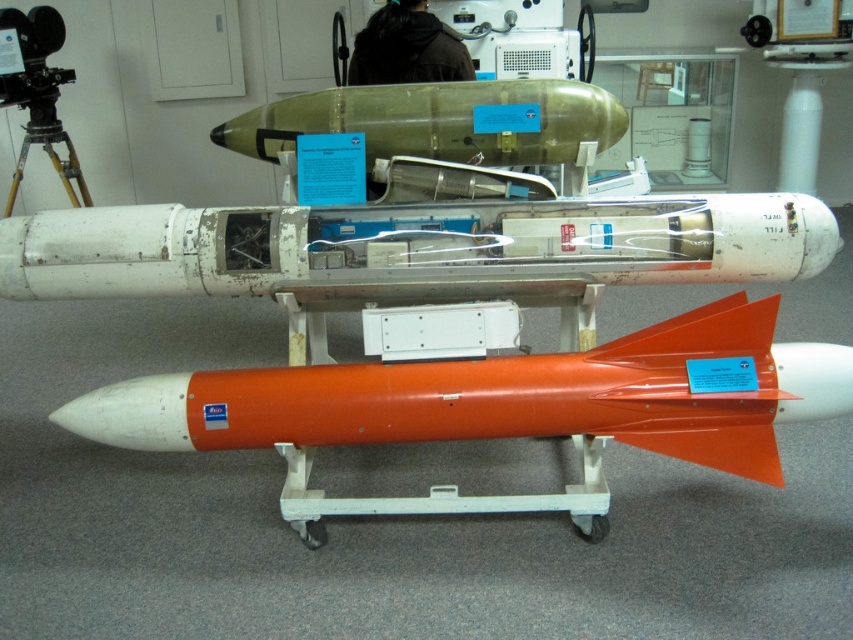
Question: Considering the relative positions of white matte missile at center and orange matte rocket at center in the image provided, where is white matte missile at center located with respect to orange matte rocket at center?

Choices:
 (A) left
 (B) right

Answer: (A)

Question: Is white matte missile at center thinner than gold/yellow metal tripod at left?

Choices:
 (A) yes
 (B) no

Answer: (B)

Question: Can you confirm if white matte missile at center is thinner than orange matte rocket at center?

Choices:
 (A) yes
 (B) no

Answer: (B)

Question: Considering the real-world distances, which object is closest to the gold/yellow metal tripod at left?

Choices:
 (A) white matte missile at center
 (B) orange matte rocket at center

Answer: (A)

Question: Among these points, which one is nearest to the camera?

Choices:
 (A) (763, 444)
 (B) (38, 84)

Answer: (A)

Question: Which object is positioned closest to the white matte missile at center?

Choices:
 (A) orange matte rocket at center
 (B) gold/yellow metal tripod at left

Answer: (A)